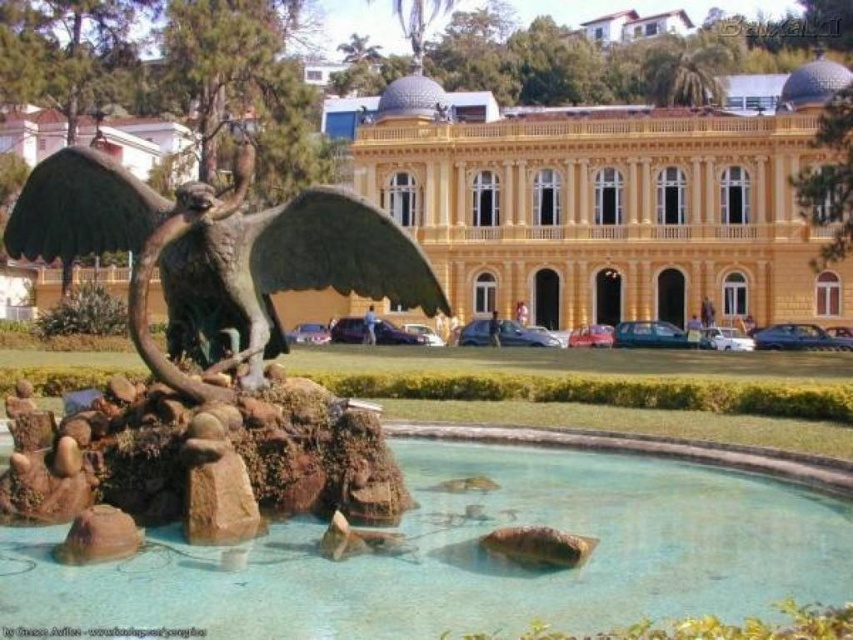
You are a maintenance worker tasked with cleaning the clear glass pond at center and the green matte wing at center. You have a 1.2 meter wide cleaning cart. Can you maneuver the cart between these two objects?

The clear glass pond at center might be wider than green matte wing at center, so there is a possibility that the cart can fit through if the space between them is at least 1.2 meters. However, since the exact width isn not specified, you should measure the space first before attempting to move the cart through.